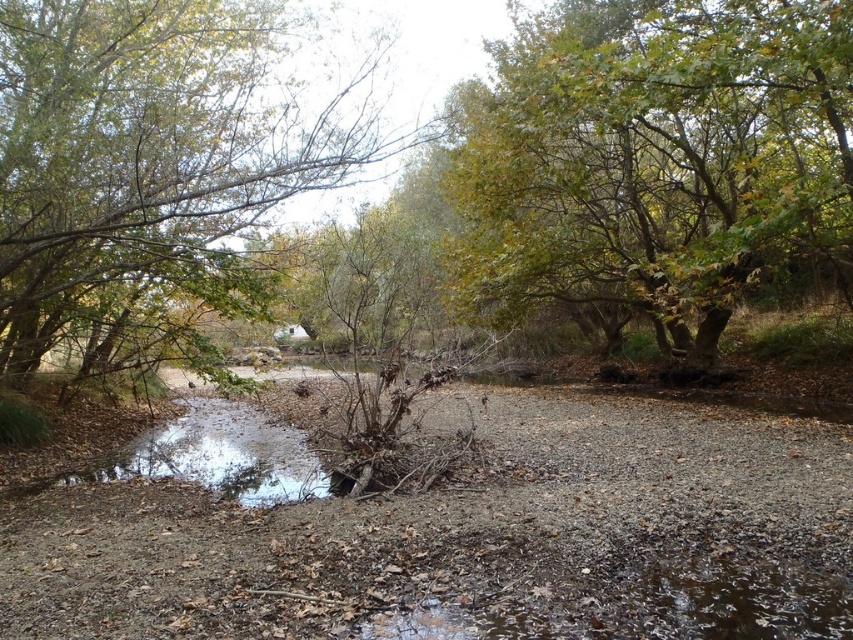
You are a hiker who wants to take a photo of the clear water at center and the green leafy tree at center. Which object should you focus on first if you want to capture both in a single frame without moving the camera?

The green leafy tree at center is larger in size than the clear water at center, so you should focus on the green leafy tree at center first to ensure it fills the frame appropriately before adjusting for the smaller clear water at center.

You are standing at the edge of the stream and want to cross to the other side. The clear water at center is flowing gently. Which direction should you walk relative to the green leafy tree at center to avoid getting your feet wet?

You should walk to the left of the green leafy tree at center to avoid the clear water at center, as the tree is positioned to the right of the water, meaning the left side is dry land.